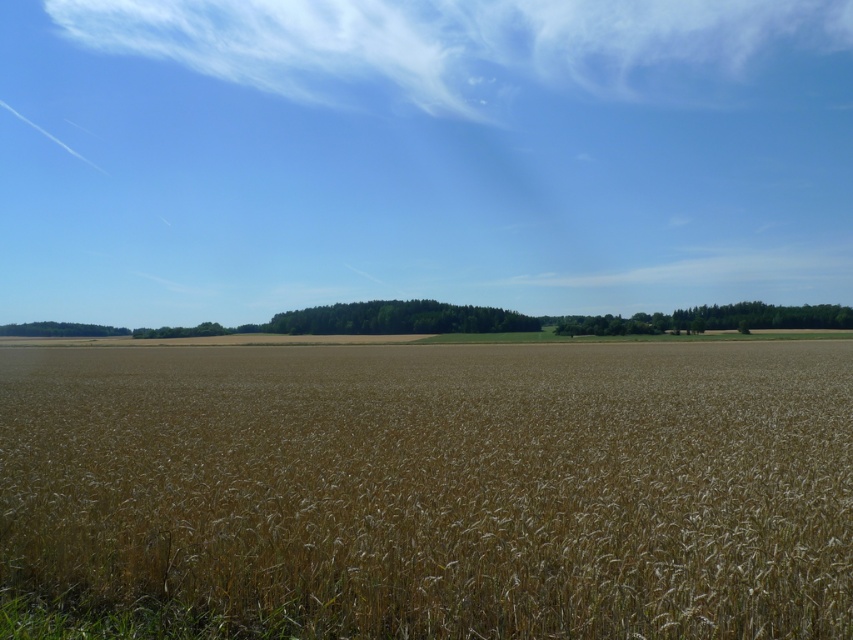
Question: Does brown grainy wheat field at center have a smaller size compared to white fluffy cloud at upper center?

Choices:
 (A) yes
 (B) no

Answer: (A)

Question: Is transparent blue sky at upper center bigger than brown grainy wheat field at center?

Choices:
 (A) yes
 (B) no

Answer: (A)

Question: Which object is closer to the camera taking this photo?

Choices:
 (A) brown grainy wheat field at center
 (B) transparent blue sky at upper center
 (C) white fluffy cloud at upper center

Answer: (A)

Question: Which object is farther from the camera taking this photo?

Choices:
 (A) transparent blue sky at upper center
 (B) brown grainy wheat field at center

Answer: (A)

Question: Among these objects, which one is nearest to the camera?

Choices:
 (A) transparent blue sky at upper center
 (B) brown grainy wheat field at center
 (C) white fluffy cloud at upper center

Answer: (B)

Question: Does transparent blue sky at upper center appear on the right side of brown grainy wheat field at center?

Choices:
 (A) no
 (B) yes

Answer: (A)